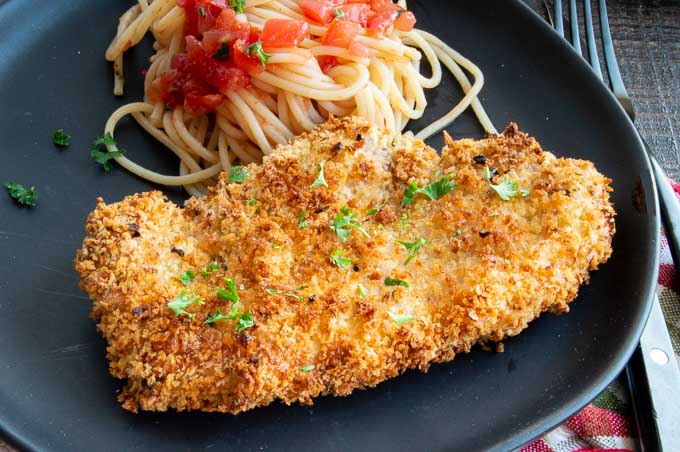
Locate an element on the screen. black textured table is located at coordinates (645, 48).